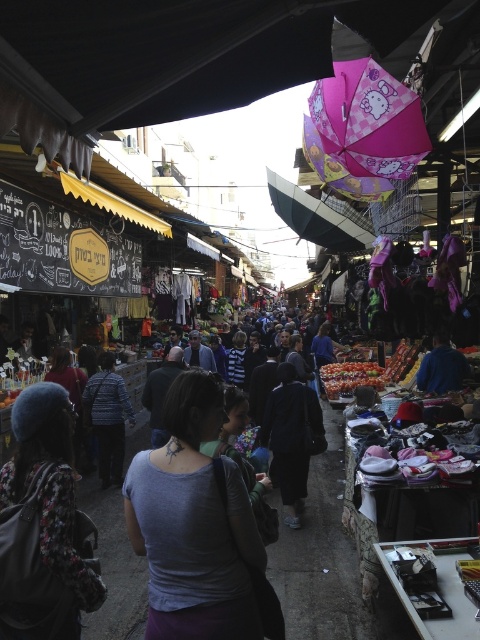
Image resolution: width=480 pixels, height=640 pixels. What do you see at coordinates (369, 120) in the screenshot?
I see `pink matte umbrella at upper center` at bounding box center [369, 120].

Is pink matte umbrella at upper center positioned at the back of dark blue fabric jacket at center?

No, it is in front of dark blue fabric jacket at center.

I want to click on pink matte umbrella at upper center, so click(x=369, y=120).

Can you confirm if purple matte shirt at center is positioned above floral fabric jacket at lower left?

Yes.

Can you confirm if purple matte shirt at center is taller than floral fabric jacket at lower left?

Yes.

Between point (213, 387) and point (7, 483), which one is positioned in front?

Positioned in front is point (213, 387).

Find the location of a particular element. Image resolution: width=480 pixels, height=640 pixels. purple matte shirt at center is located at coordinates (193, 524).

Is pink matte umbrella at upper center above striped shirt at center?

Correct, pink matte umbrella at upper center is located above striped shirt at center.

Which is above, pink matte umbrella at upper center or striped shirt at center?

Positioned higher is pink matte umbrella at upper center.

Locate an element on the screen. pink matte umbrella at upper center is located at coordinates coord(369,120).

Where is `pink matte umbrella at upper center`? This screenshot has width=480, height=640. pink matte umbrella at upper center is located at coordinates (369, 120).